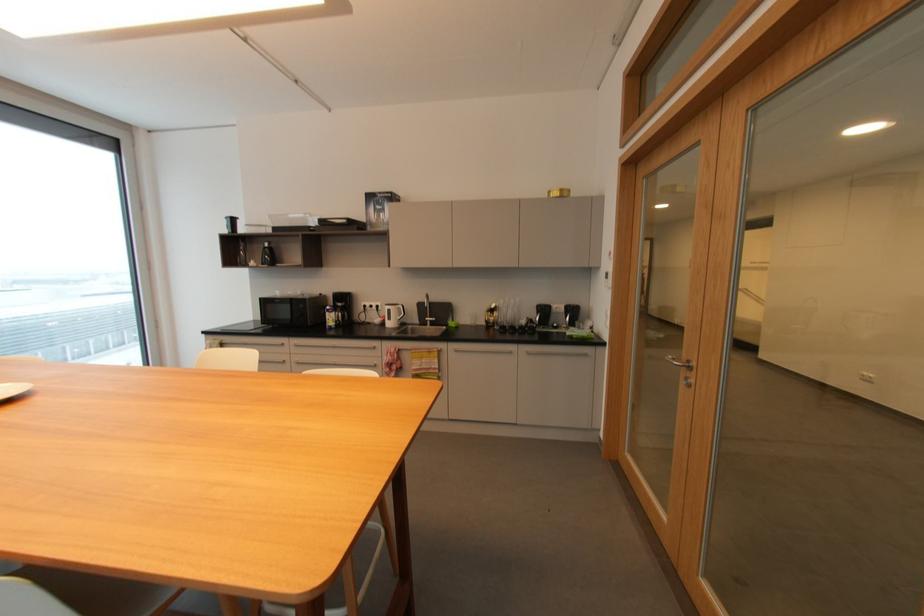
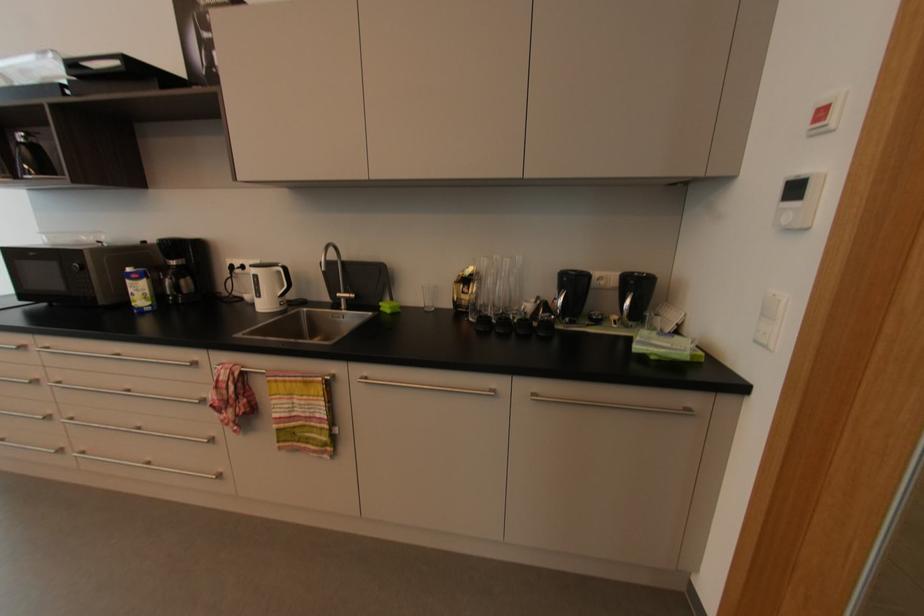
The point at (512,321) is marked in the first image. Where is the corresponding point in the second image?

(500, 304)